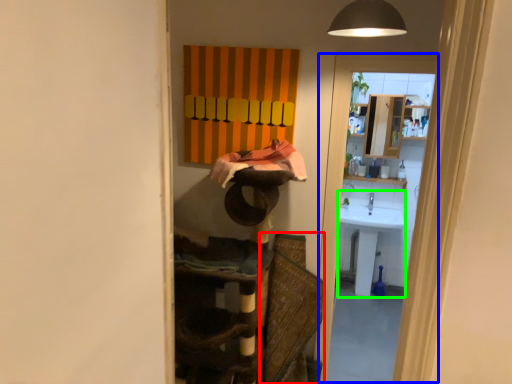
Question: Estimate the real-world distances between objects in this image. Which object is closer to swivel chair (highlighted by a red box), screen door (highlighted by a blue box) or sink (highlighted by a green box)?

Choices:
 (A) screen door
 (B) sink

Answer: (A)